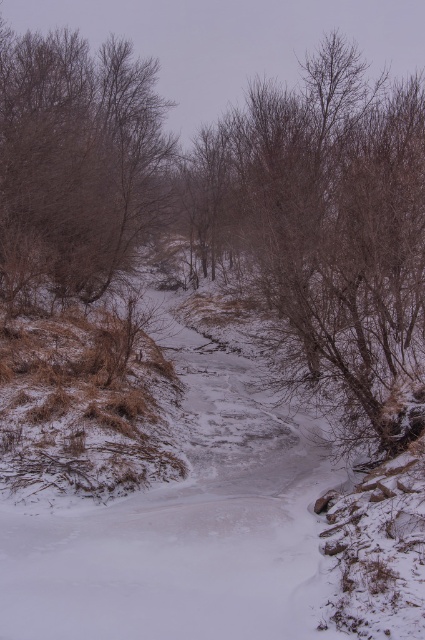
Between brown/dry wood at center and brown/dry wood at upper left, which one has less height?

Standing shorter between the two is brown/dry wood at upper left.

Who is higher up, brown/dry wood at center or brown/dry wood at upper left?

brown/dry wood at upper left is above.

Is point (394, 419) closer to viewer compared to point (144, 182)?

Yes.

Identify the location of brown/dry wood at center. (325, 230).